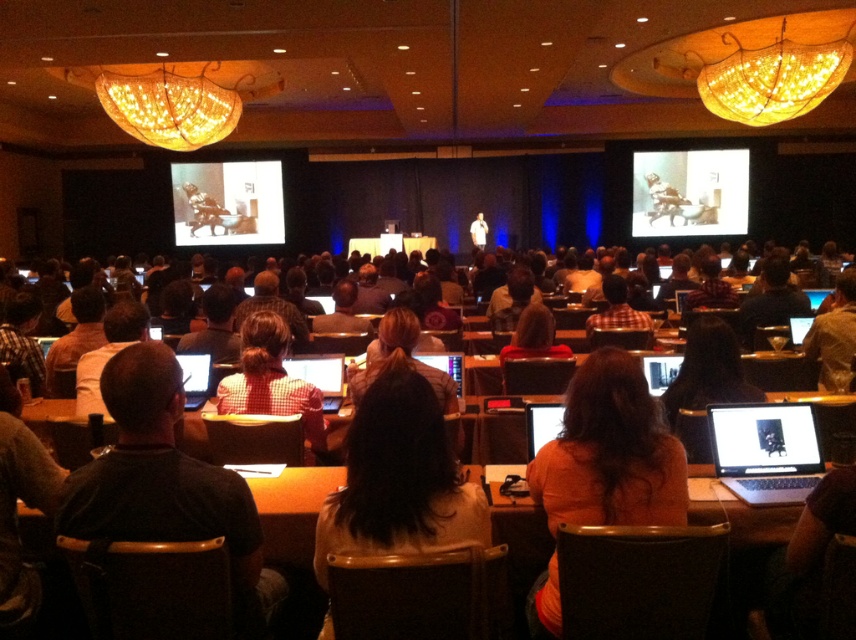
Can you confirm if orange fabric shirt at center is bigger than white shirt at center?

Incorrect, orange fabric shirt at center is not larger than white shirt at center.

Can you confirm if orange fabric shirt at center is thinner than white shirt at center?

In fact, orange fabric shirt at center might be wider than white shirt at center.

Between point (593, 388) and point (484, 243), which one is positioned behind?

Point (484, 243)

This screenshot has width=856, height=640. What are the coordinates of `orange fabric shirt at center` in the screenshot? It's located at (610, 452).

Between matte black screen at upper center and matte black laptop at lower right, which one is positioned lower?

matte black laptop at lower right is lower down.

Is point (638, 227) positioned after point (756, 440)?

Yes, point (638, 227) is behind point (756, 440).

Find the location of a particular element. The height and width of the screenshot is (640, 856). matte black screen at upper center is located at coordinates (690, 193).

Is matte black chair at upper left positioned in front of matte black laptop at lower right?

That is False.

Is point (268, 202) closer to camera compared to point (777, 451)?

That is False.

Find the location of a particular element. Image resolution: width=856 pixels, height=640 pixels. matte black chair at upper left is located at coordinates 227,202.